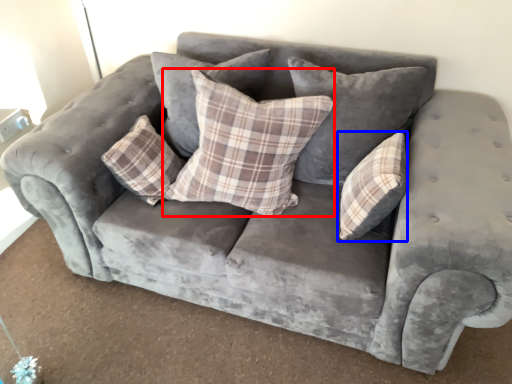
Question: Which of the following is the farthest to the observer, pillow (highlighted by a red box) or pillow (highlighted by a blue box)?

Choices:
 (A) pillow
 (B) pillow

Answer: (B)